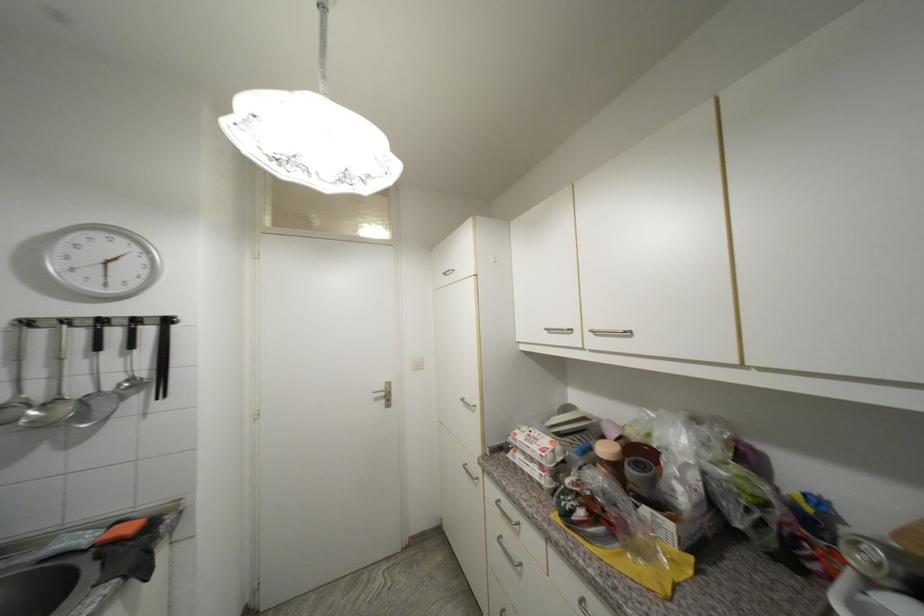
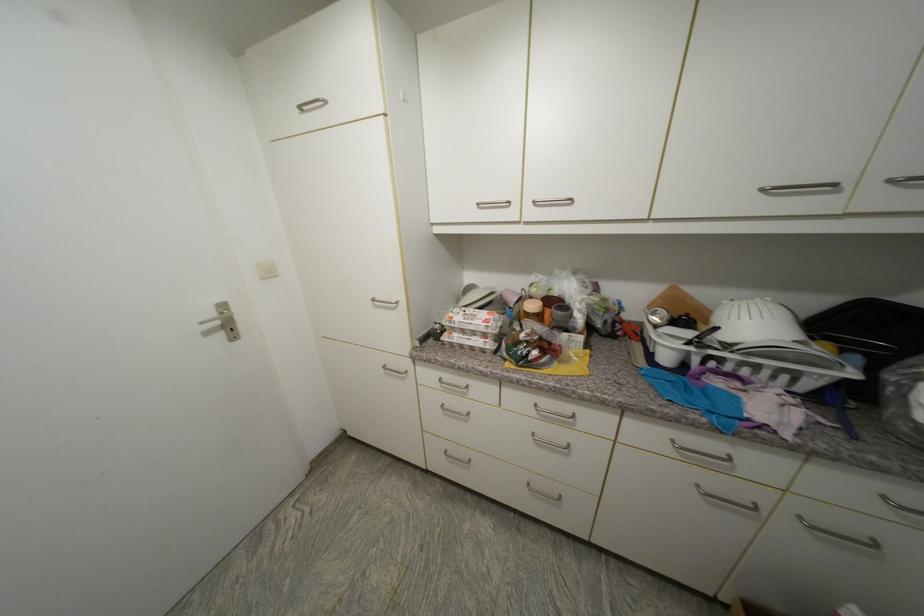
Where in the second image is the point corresponding to point 612,451 from the first image?

(538, 307)